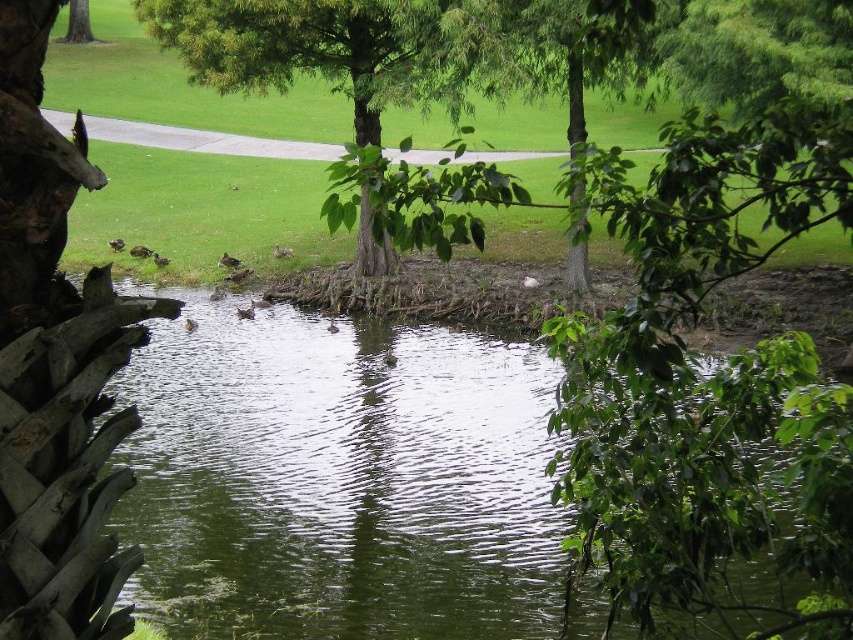
You are standing in the park and see the green liquid water at center and the green leafy tree at center. From your perspective, which object is positioned to the right?

The green liquid water at center is to the right of the green leafy tree at center.

You are standing in the park and want to take a photo of the green leafy tree trunk at center and the green liquid water at center. Which object will appear closer to the camera in your photo?

The green liquid water at center will appear closer to the camera because the green leafy tree trunk at center is behind it.

You are a gardener standing at the edge of the green liquid water at center. You need to reach the green leafy tree at center to prune its branches. Can you walk directly to it without getting wet?

The distance between the green liquid water at center and the green leafy tree at center is 3.70 meters. Since the water is at the center and the tree is also at the center, there might be a path around the water. However, the question specifies walking directly. If the tree is across the water, you would get wet. But according to the scene, the tree is at the center like the water, perhaps on the bank. Without more details, it is unclear. However, the objects description only mentions distance, so assuming